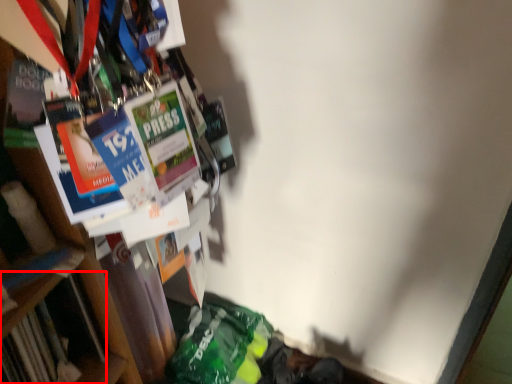
Question: Where is book (annotated by the red box) located in relation to bookcase in the image?

Choices:
 (A) left
 (B) right

Answer: (A)